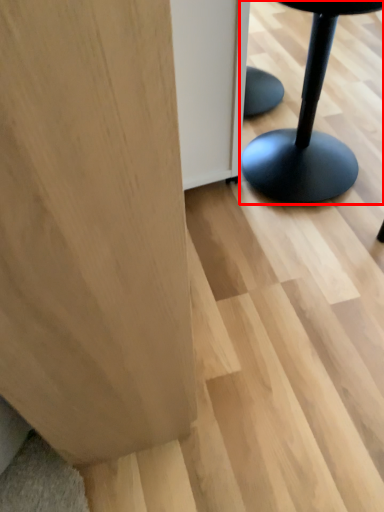
Question: From the image, what is the correct spatial relationship of furniture (annotated by the red box) in relation to plywood?

Choices:
 (A) left
 (B) right

Answer: (B)